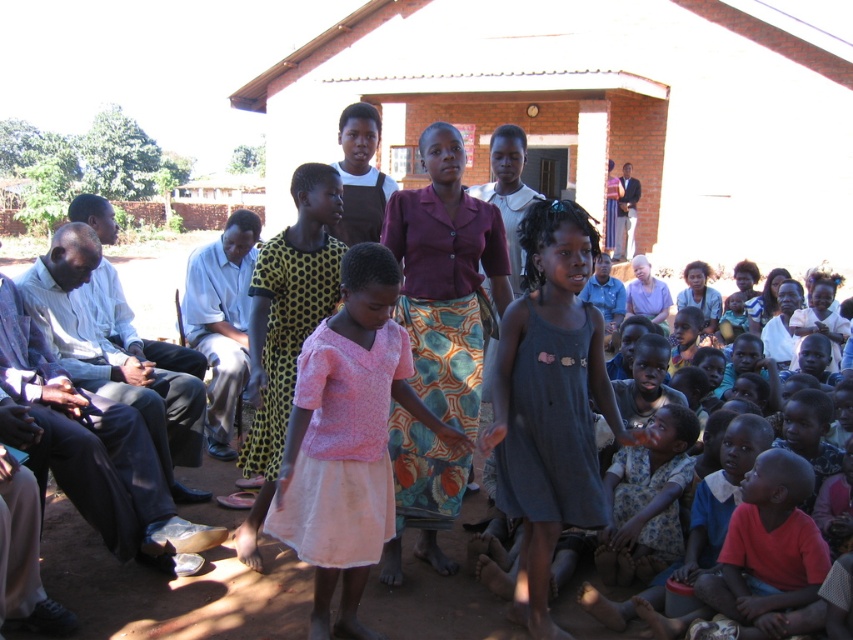
You are a photographer trying to capture a group photo of the pink fabric dress at center and the white shirt at left. Based on their heights, which one should you position closer to the front to ensure both are visible?

The pink fabric dress at center is shorter than the white shirt at left, so you should position the pink fabric dress at center closer to the front to ensure both are visible.

You are at a rural gathering and see two children wearing the dark gray cotton dress at center and the purple fabric skirt at center. Which child is positioned to the right of the other?

The dark gray cotton dress at center is positioned to the right of the purple fabric skirt at center.